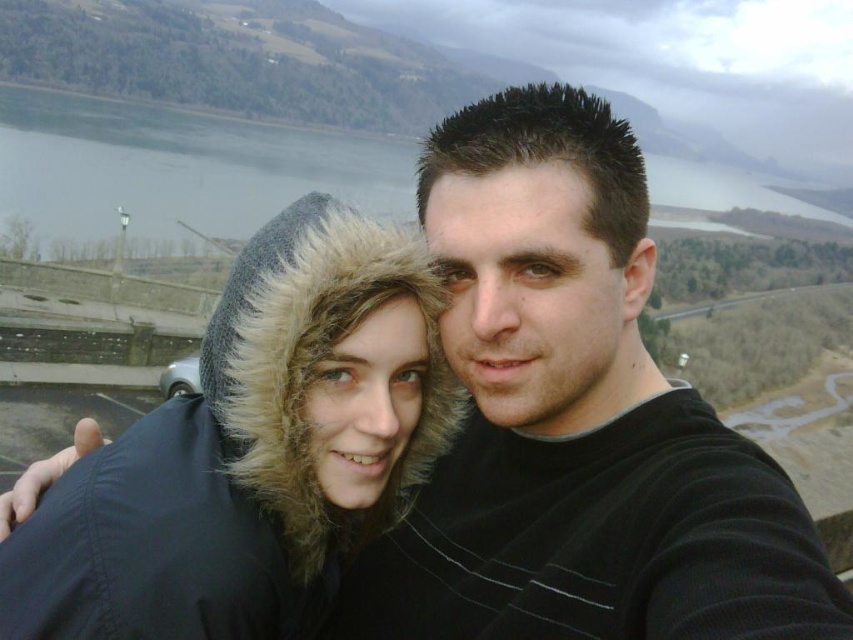
You are planning to take a photo similar to the one described. You want to ensure that the fuzzy fur hood at center is visible above the gray water at upper center in the background. Based on the scene description, will this be possible?

The fuzzy fur hood at center is shorter than gray water at upper center, so it will not be visible above the gray water at upper center in the background.